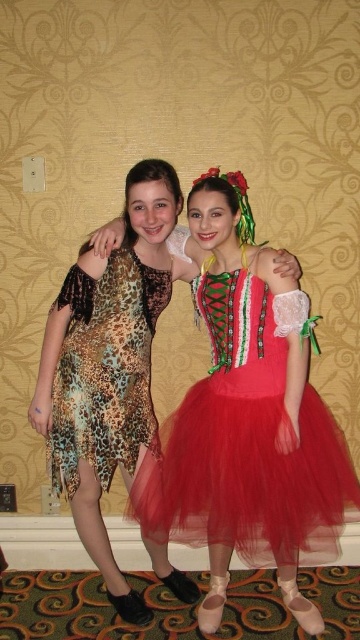
Is red tulle dress at center thinner than leopard print dress at center?

Incorrect, red tulle dress at center's width is not less than leopard print dress at center's.

Who is positioned more to the left, red tulle dress at center or leopard print dress at center?

Positioned to the left is leopard print dress at center.

You are a GUI agent. You are given a task and a screenshot of the screen. Output one action in this format:
    pyautogui.click(x=<x>, y=<y>)
    Task: Click on the red tulle dress at center
    
    Given the screenshot: What is the action you would take?
    pyautogui.click(x=245, y=444)

The height and width of the screenshot is (640, 360). I want to click on red tulle dress at center, so click(x=245, y=444).

Which is in front, point (272, 328) or point (133, 312)?

Point (272, 328) is in front.

Is red tulle dress at center wider than leopard print dress at left?

Yes, red tulle dress at center is wider than leopard print dress at left.

Describe the element at coordinates (245, 444) in the screenshot. The width and height of the screenshot is (360, 640). I see `red tulle dress at center` at that location.

The width and height of the screenshot is (360, 640). Find the location of `red tulle dress at center`. red tulle dress at center is located at coordinates (245, 444).

Where is `leopard print dress at center`? The width and height of the screenshot is (360, 640). leopard print dress at center is located at coordinates (108, 364).

Is leopard print dress at center wider than leopard print dress at left?

Yes.

At what (x,y) coordinates should I click in order to perform the action: click on leopard print dress at center. Please return your answer as a coordinate pair (x, y). Looking at the image, I should click on (108, 364).